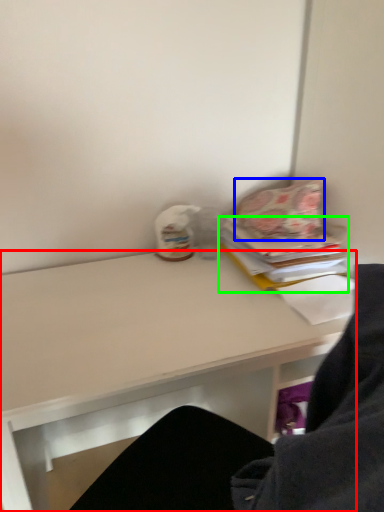
Question: Which is farther away from desk (highlighted by a red box)? pillow (highlighted by a blue box) or paperback book (highlighted by a green box)?

Choices:
 (A) pillow
 (B) paperback book

Answer: (A)